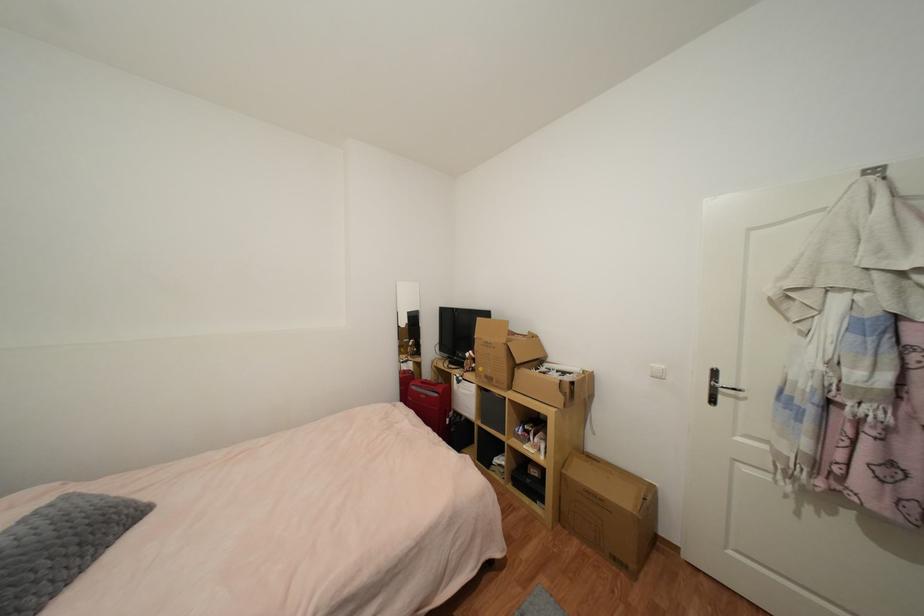
Find where to press the white light switch. Please return your answer as a coordinate pair (x, y).

(658, 371)